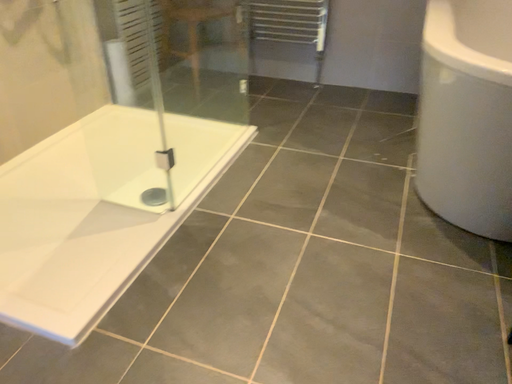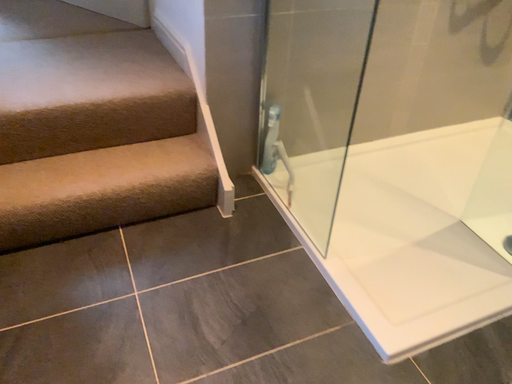
Question: How did the camera likely rotate when shooting the video?

Choices:
 (A) rotated left
 (B) rotated right

Answer: (A)